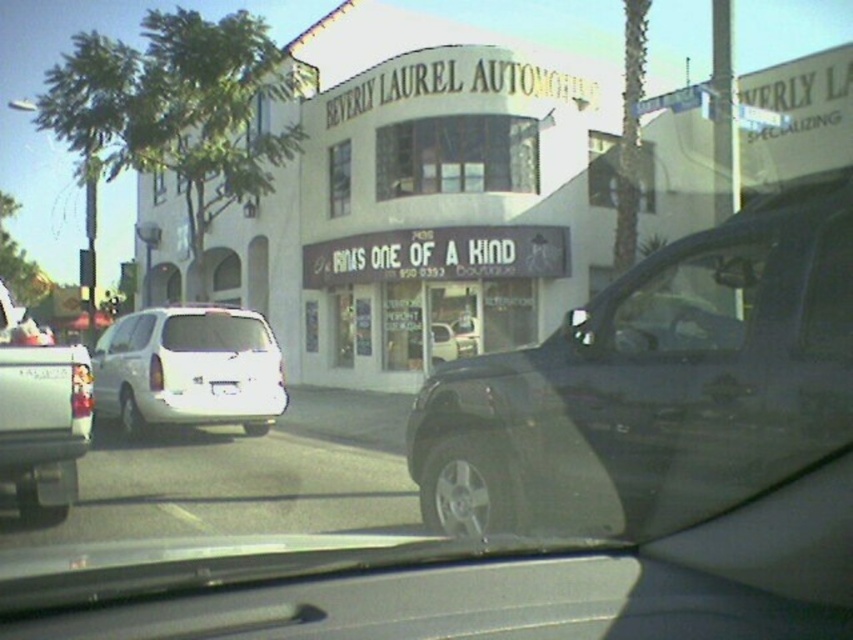
Measure the distance between shiny black car at center and white matte truck at left.

shiny black car at center is 9.51 meters away from white matte truck at left.

Can you confirm if shiny black car at center is smaller than white matte truck at left?

Incorrect, shiny black car at center is not smaller in size than white matte truck at left.

Does point (579, 348) lie behind point (4, 358)?

That is False.

Where is `shiny black car at center`? shiny black car at center is located at coordinates (654, 385).

Does white matte truck at left appear over clear glass windshield at center?

Actually, white matte truck at left is below clear glass windshield at center.

Who is more forward, (10, 336) or (177, 324)?

Point (10, 336)

Find the location of a particular element. Image resolution: width=853 pixels, height=640 pixels. white matte truck at left is located at coordinates (39, 420).

Consider the image. Is white matte truck at left bigger than transparent glass window at center?

Incorrect, white matte truck at left is not larger than transparent glass window at center.

This screenshot has width=853, height=640. Describe the element at coordinates (39, 420) in the screenshot. I see `white matte truck at left` at that location.

Where is `white matte truck at left`? The width and height of the screenshot is (853, 640). white matte truck at left is located at coordinates (39, 420).